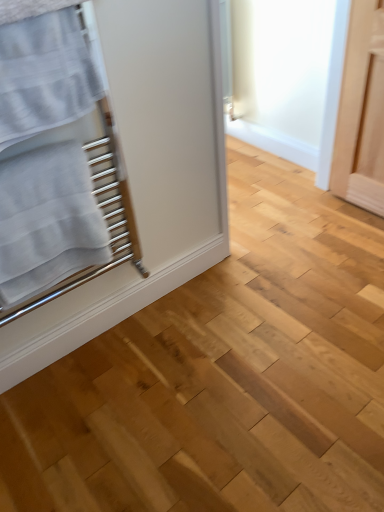
Question: From the image's perspective, is white textured towel at left, which is the second bath towel in bottom-to-top order, above or below white textured towel at left, acting as the second bath towel starting from the top?

Choices:
 (A) above
 (B) below

Answer: (A)

Question: Considering the positions of white textured towel at left, the 1th bath towel in the top-to-bottom sequence, and white textured towel at left, acting as the first bath towel starting from the bottom, in the image, is white textured towel at left, the 1th bath towel in the top-to-bottom sequence, taller or shorter than white textured towel at left, acting as the first bath towel starting from the bottom,?

Choices:
 (A) tall
 (B) short

Answer: (B)

Question: Relative to white textured towel at left, acting as the first bath towel starting from the bottom, is white textured towel at left, the 1th bath towel in the top-to-bottom sequence, in front or behind?

Choices:
 (A) behind
 (B) front

Answer: (B)

Question: Looking at their shapes, would you say white textured towel at left, acting as the second bath towel starting from the top, is wider or thinner than white textured towel at left, the 1th bath towel in the top-to-bottom sequence?

Choices:
 (A) thin
 (B) wide

Answer: (B)

Question: Based on their sizes in the image, would you say white textured towel at left, acting as the second bath towel starting from the top, is bigger or smaller than white textured towel at left, the 1th bath towel in the top-to-bottom sequence?

Choices:
 (A) big
 (B) small

Answer: (A)

Question: Do you think white textured towel at left, acting as the second bath towel starting from the top, is within white textured towel at left, which is the second bath towel in bottom-to-top order, or outside of it?

Choices:
 (A) inside
 (B) outside

Answer: (B)

Question: Considering the positions of point (34, 156) and point (82, 53), is point (34, 156) closer or farther from the camera than point (82, 53)?

Choices:
 (A) farther
 (B) closer

Answer: (A)